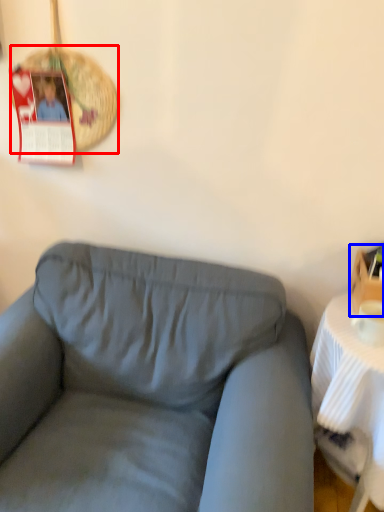
Question: Which object appears closest to the camera in this image, basket (highlighted by a red box) or box (highlighted by a blue box)?

Choices:
 (A) basket
 (B) box

Answer: (B)